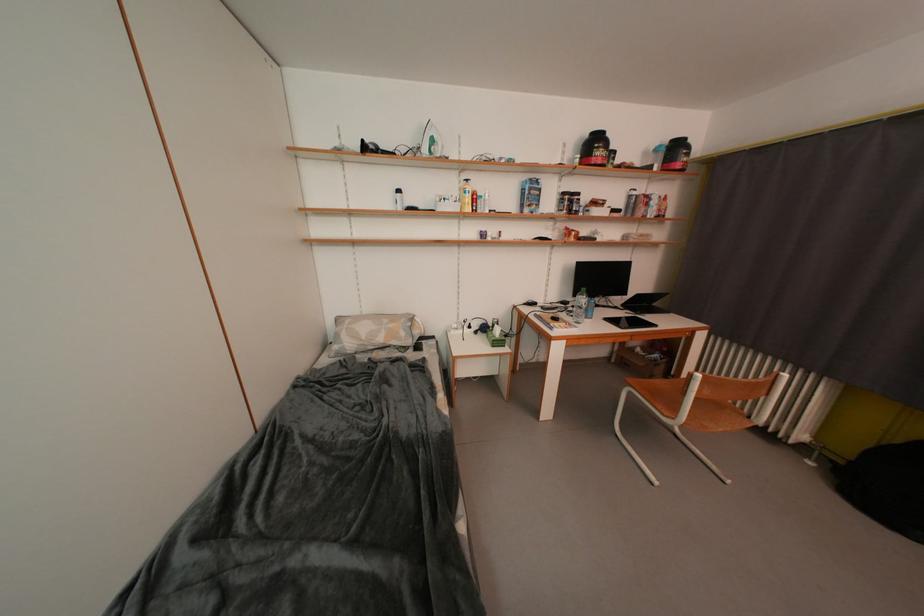
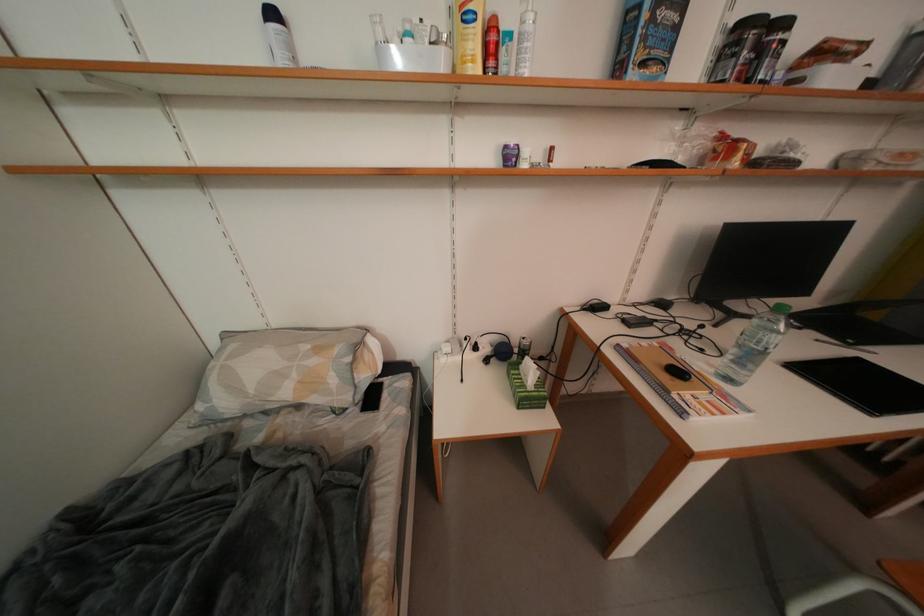
Question: What movement of the cameraman would produce the second image?

Choices:
 (A) Left
 (B) Right
 (C) Forward
 (D) Backward

Answer: (C)